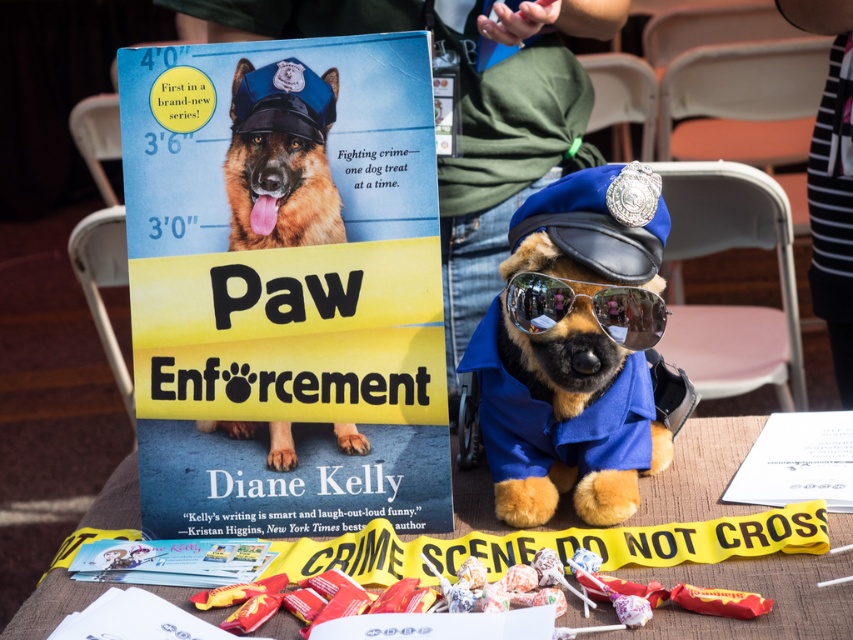
Question: Among these points, which one is nearest to the camera?

Choices:
 (A) pos(782,612)
 (B) pos(602,580)
 (C) pos(282,81)
 (D) pos(614,340)

Answer: (A)

Question: Among these objects, which one is farthest from the camera?

Choices:
 (A) reflective plastic goggles at center
 (B) shiny brown fur at center
 (C) wooden table at center

Answer: (B)

Question: Considering the real-world distances, which object is farthest from the matte plastic candy at lower center?

Choices:
 (A) wooden table at center
 (B) reflective plastic goggles at center
 (C) shiny brown fur at center

Answer: (C)

Question: Is matte plastic candy at lower center smaller than reflective plastic goggles at center?

Choices:
 (A) yes
 (B) no

Answer: (B)

Question: Is wooden table at center wider than shiny brown fur at center?

Choices:
 (A) no
 (B) yes

Answer: (B)

Question: Is wooden table at center bigger than matte plastic candy at lower center?

Choices:
 (A) yes
 (B) no

Answer: (A)